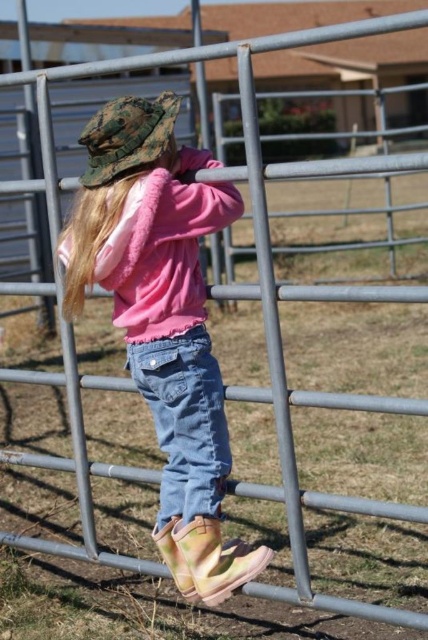
Question: Which object appears farthest from the camera in this image?

Choices:
 (A) pink fleece jacket at center
 (B) denim jeans at center
 (C) camouflage fabric hat at upper left

Answer: (B)

Question: Which of the following is the closest to the observer?

Choices:
 (A) pink fleece jacket at center
 (B) denim jeans at center
 (C) camouflage fabric hat at upper left

Answer: (C)

Question: Where is pink fleece jacket at center located in relation to camouflage fabric hat at upper left in the image?

Choices:
 (A) left
 (B) right

Answer: (B)

Question: Can you confirm if pink fleece jacket at center is smaller than camouflage fabric hat at upper left?

Choices:
 (A) no
 (B) yes

Answer: (A)

Question: Among these objects, which one is nearest to the camera?

Choices:
 (A) pink fleece jacket at center
 (B) denim jeans at center
 (C) camouflage fabric hat at upper left

Answer: (C)

Question: Can you confirm if pink fleece jacket at center is smaller than denim jeans at center?

Choices:
 (A) no
 (B) yes

Answer: (A)